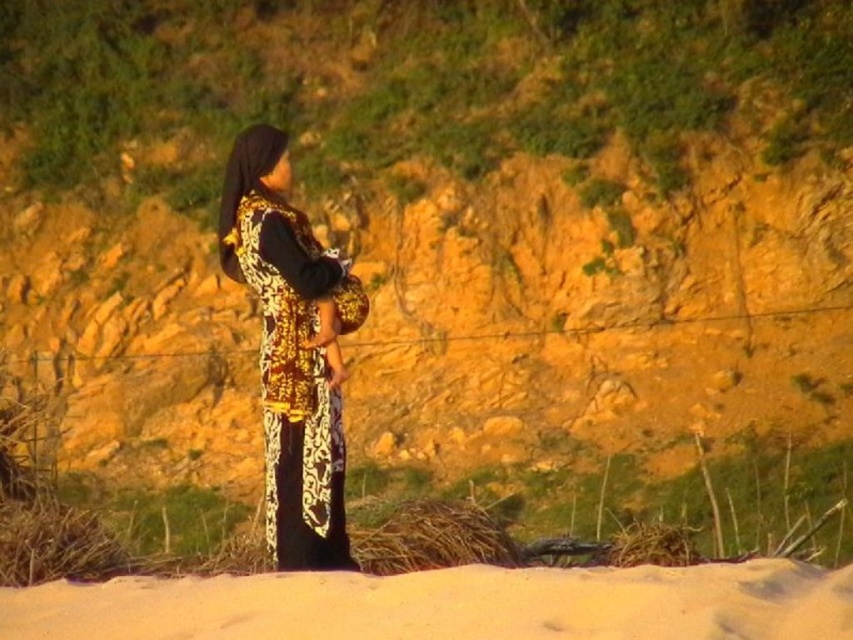
In the serene outdoor scene, there is a sandy area in the foreground and a person wearing a traditional outfit in the midground. Where is the point located at coordinates [450,604] in relation to the sandy yellow sand at bottom?

The point at coordinates [450,604] is located on the sandy yellow sand at bottom.

You are a photographer trying to capture a photo of the gold embroidered dress at center. Since the sandy yellow sand at bottom is under it, where should you position yourself to ensure the dress is fully visible without the sand blocking the view?

To ensure the gold embroidered dress at center is fully visible without the sandy yellow sand at bottom blocking the view, position yourself at a higher angle or behind the dress so that the sand is below and does not obstruct the dress.